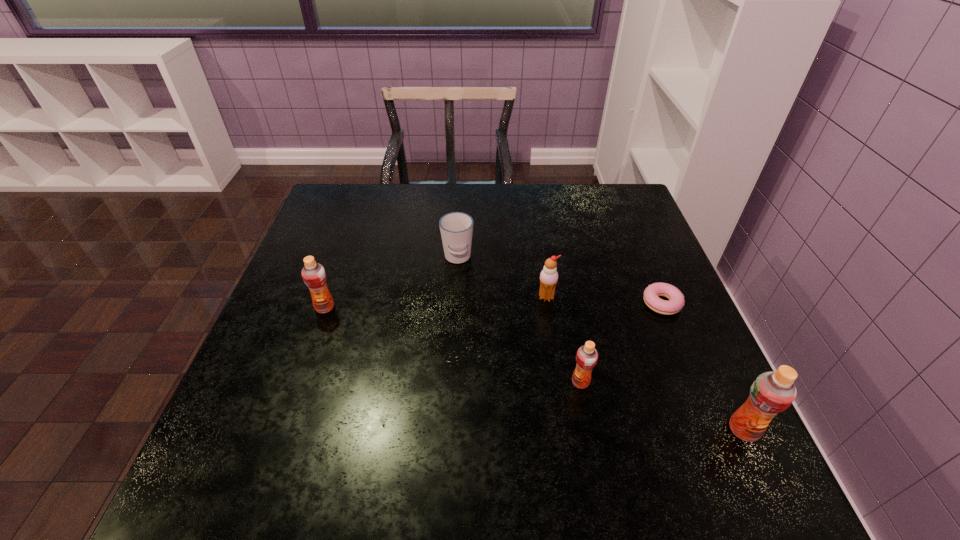
Please determine a free point for an extra orange_juice to ensure balance. Please provide its 2D coordinates. Your answer should be formatted as a tuple, i.e. [(x, y)], where the tuple contains the x and y coordinates of a point satisfying the conditions above.

[(443, 342)]